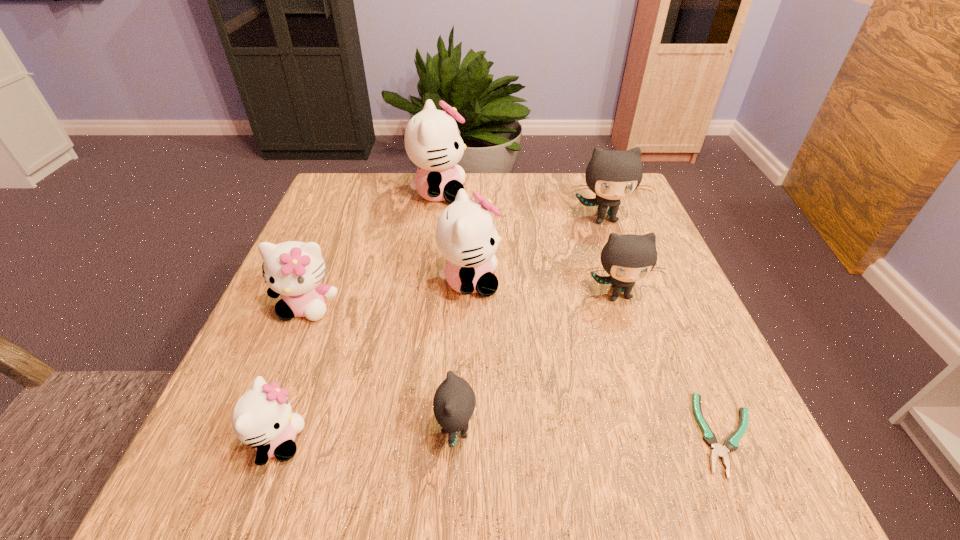
Where is `vacant area that lies between the nearest gray kitten and the farthest gray kitten`? The image size is (960, 540). vacant area that lies between the nearest gray kitten and the farthest gray kitten is located at coordinates (530, 325).

Find the location of a particular element. The height and width of the screenshot is (540, 960). free space between the farthest gray kitten and the third smallest white kitten is located at coordinates (537, 250).

Locate an element on the screen. vacant region between the third smallest white kitten and the farthest gray kitten is located at coordinates (537, 250).

Locate an element on the screen. vacant region between the shortest object and the third smallest white kitten is located at coordinates (598, 357).

You are a GUI agent. You are given a task and a screenshot of the screen. Output one action in this format:
    pyautogui.click(x=<x>, y=<y>)
    Task: Click on the free point between the teal pliers and the leftmost gray kitten
    This screenshot has height=540, width=960.
    Given the screenshot: What is the action you would take?
    pyautogui.click(x=591, y=432)

Locate an element on the screen. empty location between the nearest white kitten and the biggest white kitten is located at coordinates (359, 317).

Identify which object is located as the fifth nearest to the smallest white kitten. Please provide its 2D coordinates. Your answer should be formatted as a tuple, i.e. [(x, y)], where the tuple contains the x and y coordinates of a point satisfying the conditions above.

[(432, 139)]

This screenshot has height=540, width=960. What are the coordinates of `the fourth closest object to the nearest white kitten` in the screenshot? It's located at (627, 258).

Select which kitten is the fourth closest to the tallest kitten. Please provide its 2D coordinates. Your answer should be formatted as a tuple, i.e. [(x, y)], where the tuple contains the x and y coordinates of a point satisfying the conditions above.

[(627, 258)]

Select which kitten is the third closest to the second smallest gray kitten. Please provide its 2D coordinates. Your answer should be formatted as a tuple, i.e. [(x, y)], where the tuple contains the x and y coordinates of a point satisfying the conditions above.

[(454, 402)]